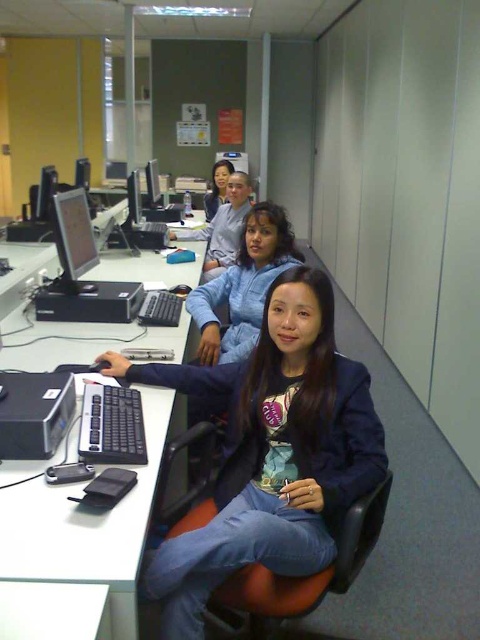
You are an office worker who needs to reach the matte black monitor at upper center to adjust its settings. However, there is a matte blue hoodie at center in the way. Can you move the hoodie to access the monitor?

The matte blue hoodie at center is further to the viewer than the matte black monitor at upper center, so moving the hoodie would allow you to access the monitor.

You are organizing a small meeting in the office and need to place a 1.5 square feet notepad on the desk. Given the space occupied by the blue denim jeans at lower center and the white plastic computer desk at center, can the notepad fit on the desk?

The blue denim jeans at lower center occupies less space than the white plastic computer desk at center. However, the white plastic computer desk at center is the actual desk surface. Since the notepad requires 1.5 square feet, and the desk is likely larger than the jeans, it should fit unless other items are present. But based on the given info, yes, the notepad can fit on the white plastic computer desk at center.

You are standing at point (348,488) in an office. You want to take a photo of the scene. If your camera is at your eye level, which is 1.68 meters above the ground, will the camera be able to capture the entire scene without moving?

The point (348,488) is 1.43 meters away from the camera. Since the camera is at 1.68 meters height, it can capture the entire scene as the distance is within a reasonable field of view and height.